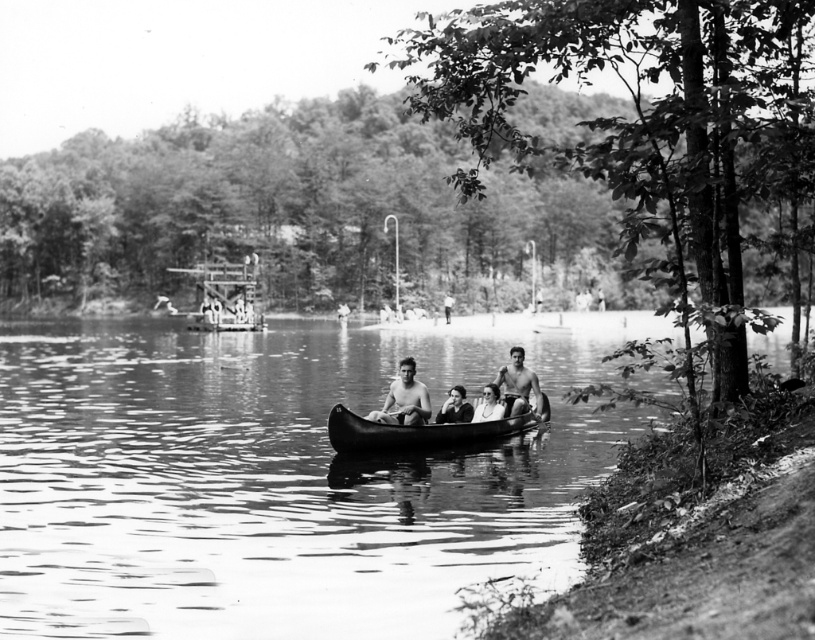
You are standing at the point with coordinates point (518, 385) in the image. What object are you directly facing?

The point (518, 385) indicates the shiny silver canoe at center, so you are directly facing the shiny silver canoe at center.

You are a photographer trying to capture a clear shot of both the shiny silver canoe at center and the smooth skin face at center in the same frame. Since you want both subjects to be visible, which one should you focus on first to ensure it appears sharp in the photo?

You should focus on the shiny silver canoe at center first because it is larger in size than the smooth skin face at center, making it more prominent and easier to capture sharply.